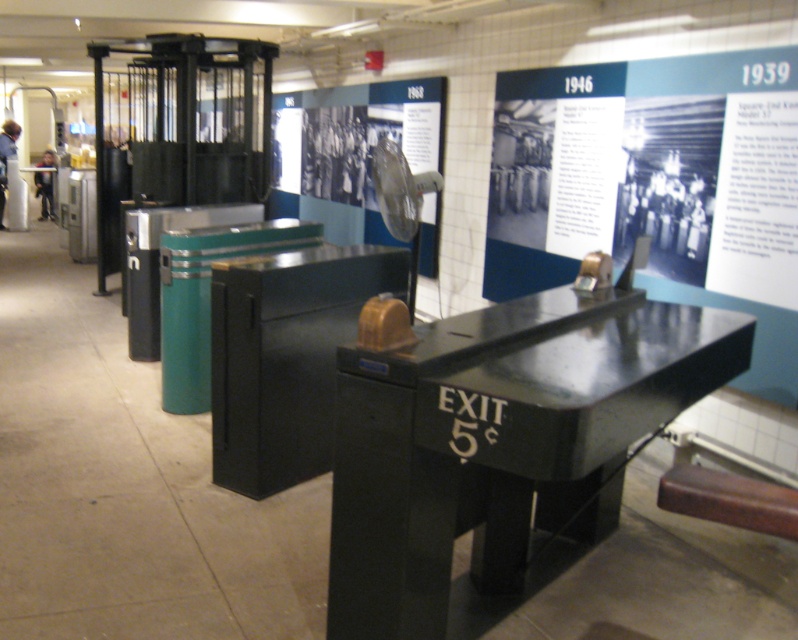
Is point (389, 602) closer to camera compared to point (793, 115)?

That is True.

Who is more distant from viewer, [542,394] or [634,132]?

The point [634,132] is more distant.

Find the location of a particular element. The image size is (798, 640). black polished wood table at center is located at coordinates (500, 442).